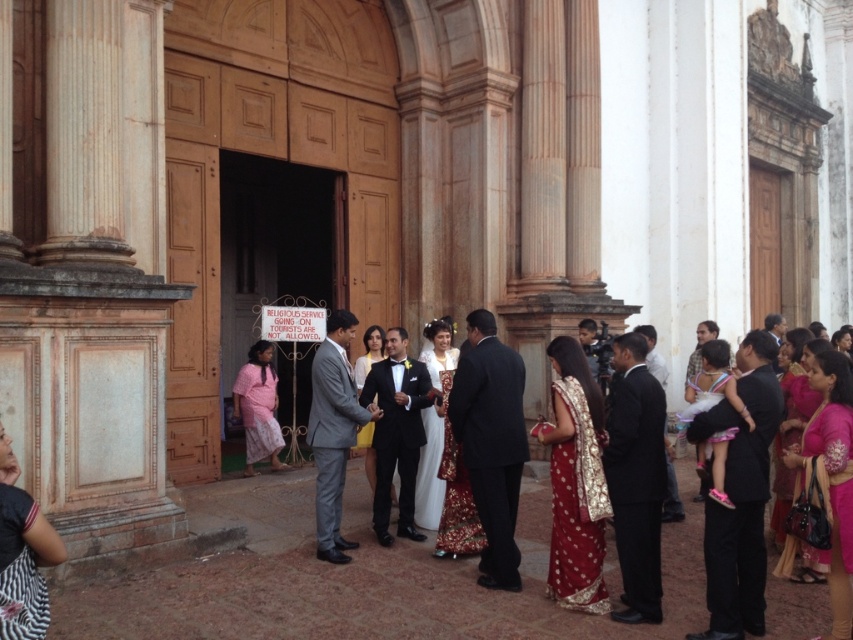
Who is positioned more to the left, red silk saree at center or gray suit at center?

From the viewer's perspective, gray suit at center appears more on the left side.

From the picture: Is red silk saree at center to the right of gray suit at center from the viewer's perspective?

Yes, red silk saree at center is to the right of gray suit at center.

Find the location of a particular element. This screenshot has width=853, height=640. red silk saree at center is located at coordinates (575, 483).

Does point (758, 564) come closer to viewer compared to point (323, 429)?

Yes, point (758, 564) is closer to viewer.

Is dark blue suit at right thinner than gray suit at center?

No.

Which is behind, point (759, 589) or point (332, 362)?

Point (332, 362)

In order to click on dark blue suit at right in this screenshot , I will do `click(740, 496)`.

Which is in front, point (390, 429) or point (25, 618)?

Point (25, 618) is more forward.

Is the position of black satin tuxedo at center more distant than that of zebra print dress at lower left?

Yes, black satin tuxedo at center is behind zebra print dress at lower left.

At what (x,y) coordinates should I click in order to perform the action: click on black satin tuxedo at center. Please return your answer as a coordinate pair (x, y). Image resolution: width=853 pixels, height=640 pixels. Looking at the image, I should click on (396, 432).